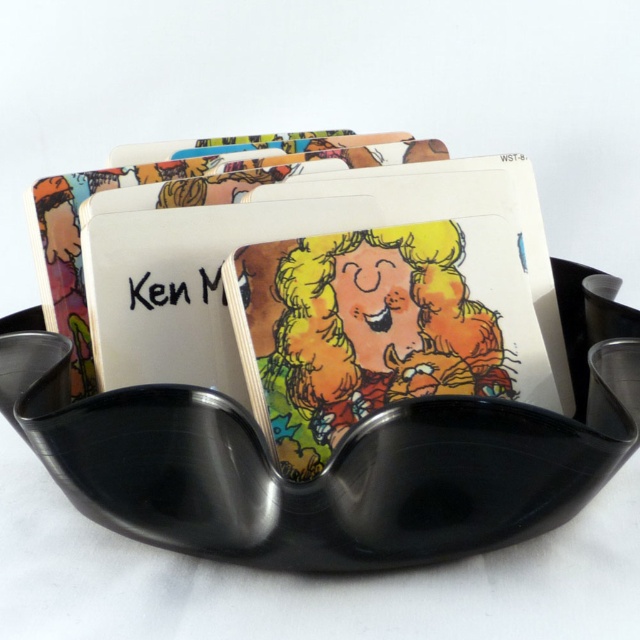
Question: Which point is closer to the camera?

Choices:
 (A) (339, 244)
 (B) (285, 157)

Answer: (A)

Question: Among these points, which one is farthest from the camera?

Choices:
 (A) (204, 333)
 (B) (88, 182)

Answer: (B)

Question: Can you confirm if matte cardboard card at center is positioned to the left of cartoon paper card at center?

Choices:
 (A) yes
 (B) no

Answer: (B)

Question: Does matte cardboard card at center appear on the left side of cartoon paper card at center?

Choices:
 (A) yes
 (B) no

Answer: (B)

Question: Is matte cardboard card at center bigger than cartoon paper card at center?

Choices:
 (A) yes
 (B) no

Answer: (A)

Question: Among these points, which one is farthest from the camera?

Choices:
 (A) (112, 224)
 (B) (77, 189)

Answer: (B)